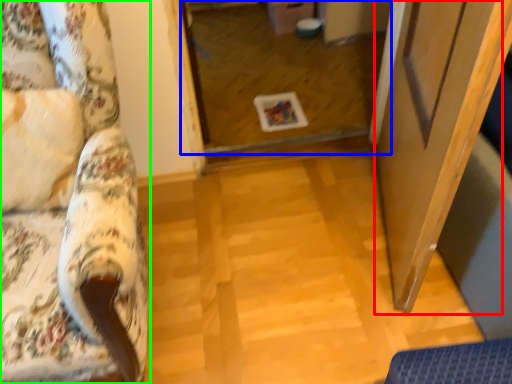
Question: Which object is the closest to the screen door (highlighted by a red box)? Choose among these: glass door (highlighted by a blue box) or furniture (highlighted by a green box).

Choices:
 (A) glass door
 (B) furniture

Answer: (B)